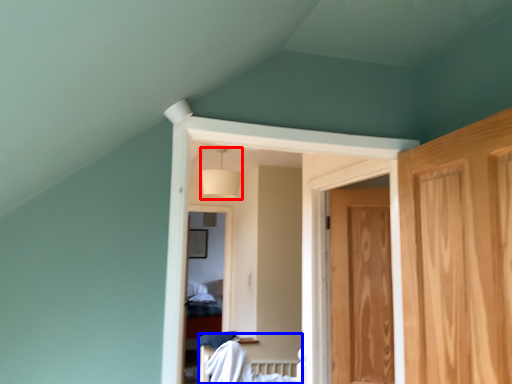
Question: Which point is further to the camera, lamp (highlighted by a red box) or bed (highlighted by a blue box)?

Choices:
 (A) lamp
 (B) bed

Answer: (A)